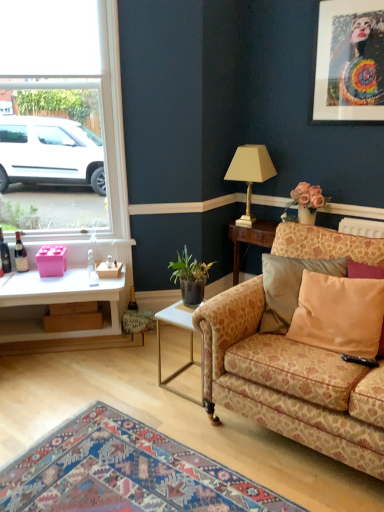
Find the location of `vacant area in front of clear glass bottle at left, positioned as the first bottle in right-to-left order`. vacant area in front of clear glass bottle at left, positioned as the first bottle in right-to-left order is located at coordinates (84, 286).